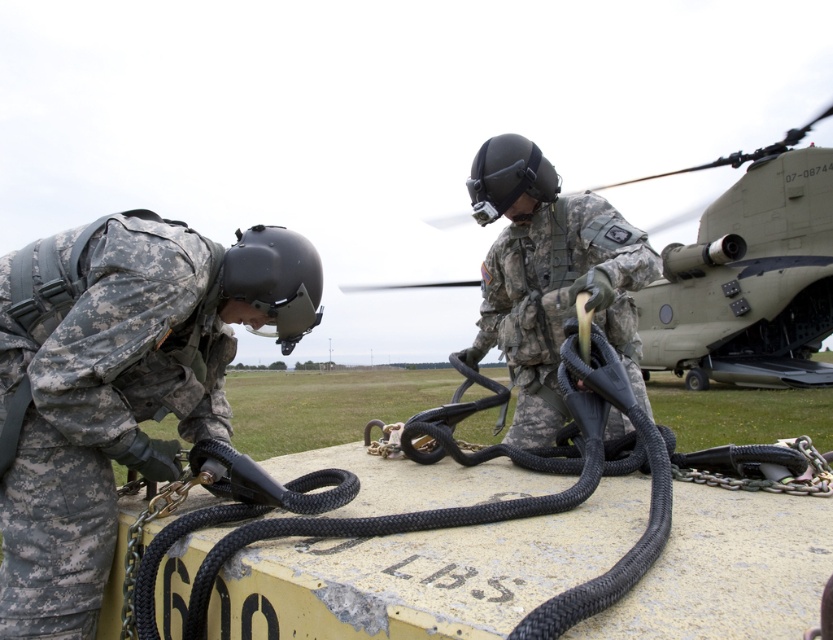
You are a military trainee observing the scene. You need to secure a 600 LBS object with the black braided rope at center and camouflage fabric helmet at center. Which object has a larger width that could help in securing the load?

The black braided rope at center has a larger width than the camouflage fabric helmet at center, so it would be more suitable for securing the 600 LBS object.

You are a military planner assessing the scene. The matte green helicopter at center and the camouflage fabric helmet at center are both in the center of the image. Which object is wider?

The matte green helicopter at center is wider than the camouflage fabric helmet at center.